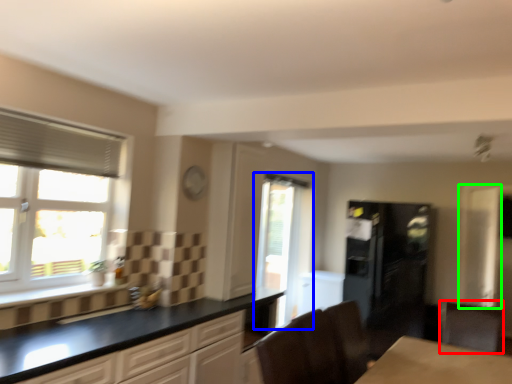
Question: Estimate the real-world distances between objects in this image. Which object is farther from cabinetry (highlighted by a red box), window (highlighted by a blue box) or screen door (highlighted by a green box)?

Choices:
 (A) window
 (B) screen door

Answer: (A)